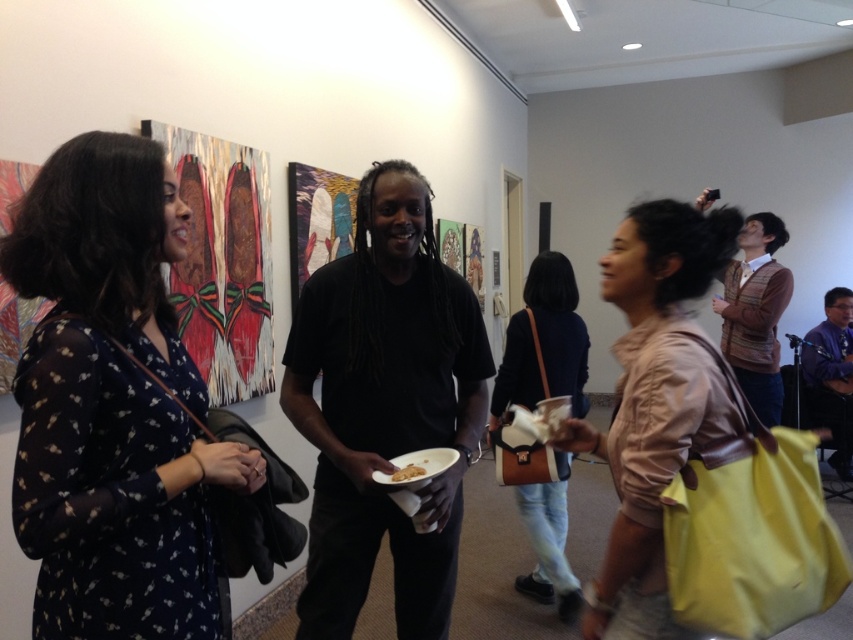
Is beige fabric bag at center shorter than yellow matte paper plate at center?

Incorrect, beige fabric bag at center's height does not fall short of yellow matte paper plate at center's.

Looking at this image, does beige fabric bag at center lie behind yellow matte paper plate at center?

No.

Does point (616, 296) come in front of point (415, 467)?

Yes, point (616, 296) is closer to viewer.

You are a GUI agent. You are given a task and a screenshot of the screen. Output one action in this format:
    pyautogui.click(x=<x>, y=<y>)
    Task: Click on the beige fabric bag at center
    
    Given the screenshot: What is the action you would take?
    pyautogui.click(x=654, y=403)

Can you confirm if dark blue floral dress at left is positioned to the right of brown sweater at upper right?

In fact, dark blue floral dress at left is to the left of brown sweater at upper right.

What do you see at coordinates (112, 404) in the screenshot? I see `dark blue floral dress at left` at bounding box center [112, 404].

Measure the distance between dark blue floral dress at left and camera.

38.04 inches

This screenshot has height=640, width=853. Identify the location of dark blue floral dress at left. (112, 404).

Measure the distance between dark blue shirt at center and yellow matte paper plate at center.

They are 4.16 meters apart.

This screenshot has height=640, width=853. Describe the element at coordinates (831, 376) in the screenshot. I see `dark blue shirt at center` at that location.

The height and width of the screenshot is (640, 853). What are the coordinates of `dark blue shirt at center` in the screenshot? It's located at (831, 376).